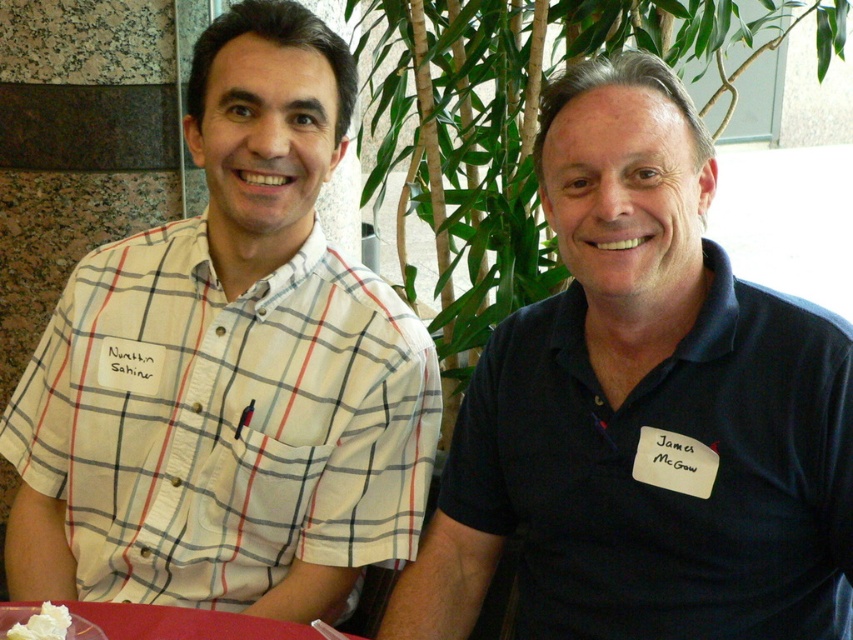
Who is positioned more to the left, white checkered shirt at center or white creamy spread at lower left?

white creamy spread at lower left is more to the left.

Where is `white checkered shirt at center`? white checkered shirt at center is located at coordinates [x=228, y=369].

From the picture: Is white checkered shirt at center smaller than dark blue polo shirt at right?

Correct, white checkered shirt at center occupies less space than dark blue polo shirt at right.

Does white checkered shirt at center have a greater width compared to dark blue polo shirt at right?

Indeed, white checkered shirt at center has a greater width compared to dark blue polo shirt at right.

This screenshot has width=853, height=640. In order to click on white checkered shirt at center in this screenshot , I will do `click(228, 369)`.

At what (x,y) coordinates should I click in order to perform the action: click on dark blue polo shirt at right. Please return your answer as a coordinate pair (x, y). Image resolution: width=853 pixels, height=640 pixels. Looking at the image, I should click on (643, 410).

Can you confirm if dark blue polo shirt at right is thinner than white creamy spread at lower left?

No, dark blue polo shirt at right is not thinner than white creamy spread at lower left.

Is point (485, 376) positioned in front of point (10, 630)?

No, it is not.

You are a GUI agent. You are given a task and a screenshot of the screen. Output one action in this format:
    pyautogui.click(x=<x>, y=<y>)
    Task: Click on the dark blue polo shirt at right
    
    Given the screenshot: What is the action you would take?
    pyautogui.click(x=643, y=410)